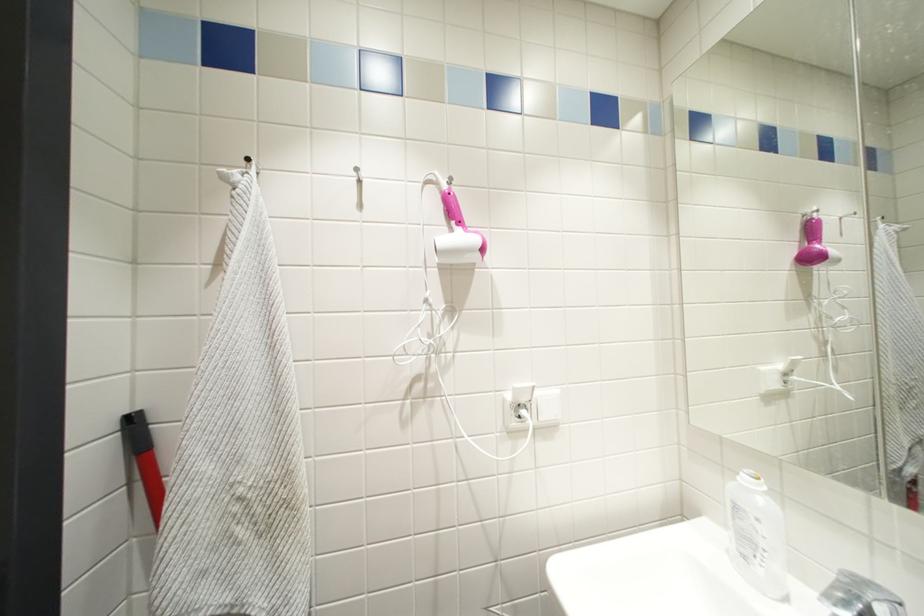
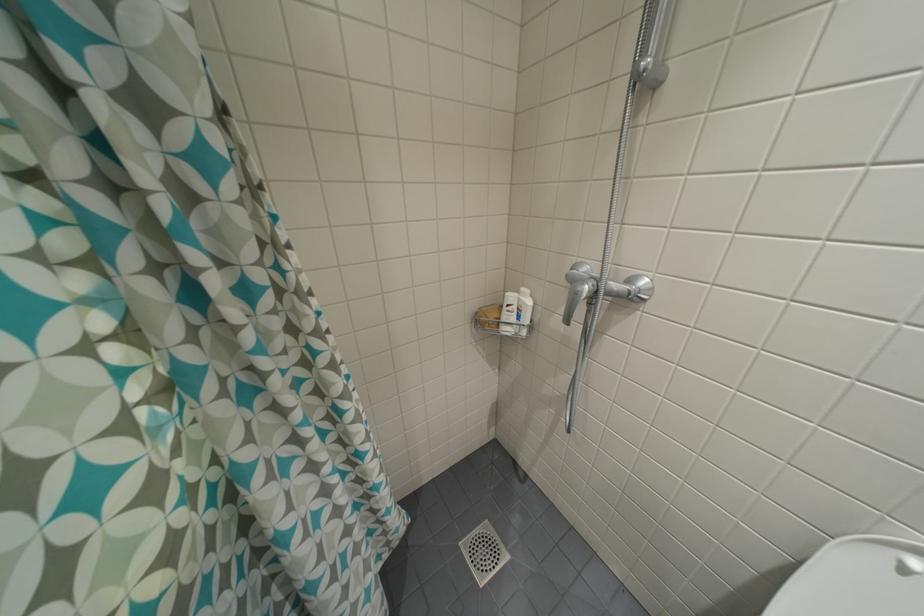
In the scene shown: The images are taken continuously from a first-person perspective. In which direction is your viewpoint rotating?

The camera's rotation is toward right-down.